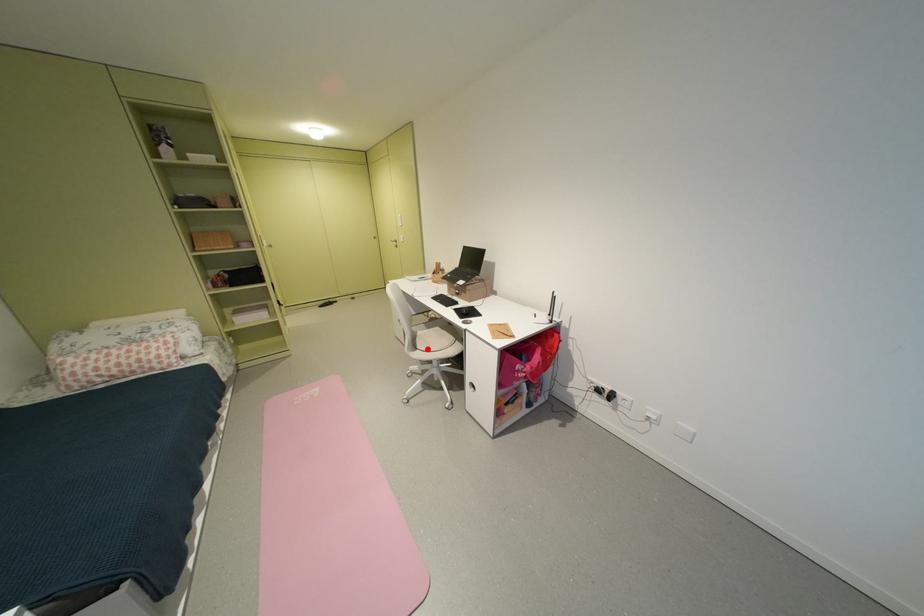
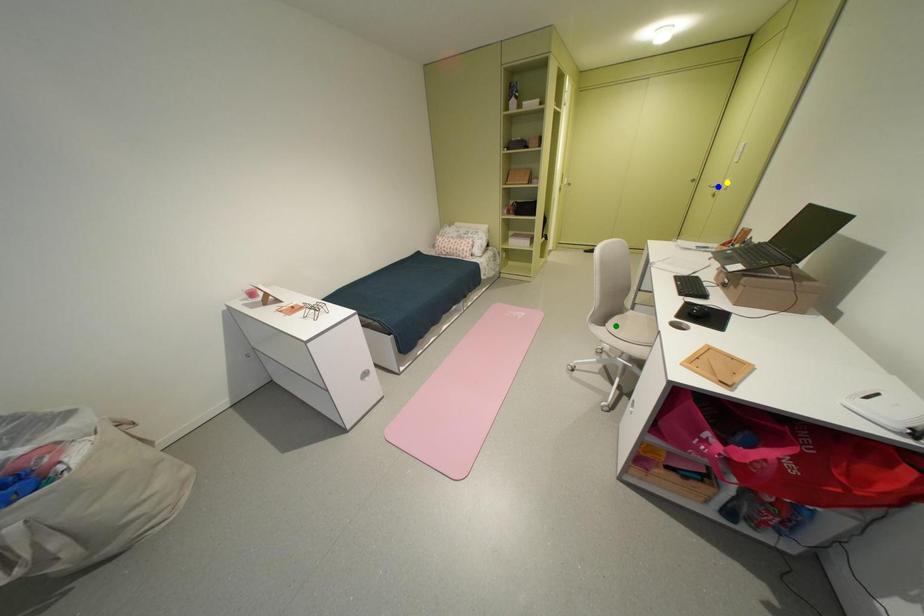
Question: I am providing you with two images of the same scene from different viewpoints. A red point is marked on the first image. You are given multiple points on the second image. Which mark in image 2 goes with the point in image 1?

Choices:
 (A) blue point
 (B) yellow point
 (C) green point

Answer: (C)